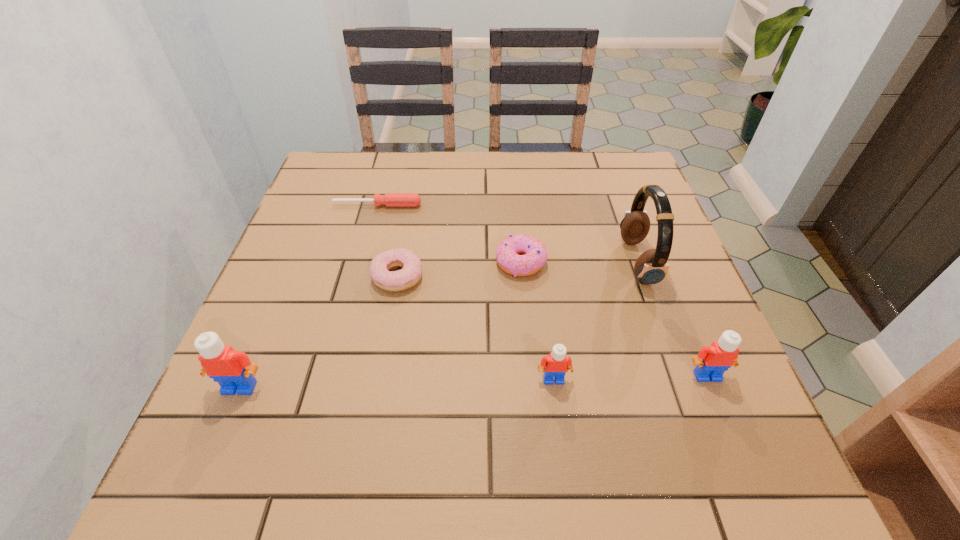
Identify the location of vacant region at the far right corner of the desktop. (635, 192).

The width and height of the screenshot is (960, 540). What are the coordinates of `vacant region at the near right corner of the desktop` in the screenshot? It's located at (720, 384).

Where is `empty space between the leftmost Lego and the shortest Lego`? This screenshot has width=960, height=540. empty space between the leftmost Lego and the shortest Lego is located at coordinates (396, 383).

At what (x,y) coordinates should I click in order to perform the action: click on free spot between the rightmost Lego and the taller doughnut. Please return your answer as a coordinate pair (x, y). Looking at the image, I should click on (613, 319).

Find the location of a particular element. The height and width of the screenshot is (540, 960). vacant area that lies between the shortest Lego and the screwdriver is located at coordinates (466, 292).

Find the location of a particular element. empty space that is in between the right doughnut and the shortest object is located at coordinates (449, 233).

You are a GUI agent. You are given a task and a screenshot of the screen. Output one action in this format:
    pyautogui.click(x=<x>, y=<y>)
    Task: Click on the vacant area that lies between the screwdriver and the right doughnut
    
    Given the screenshot: What is the action you would take?
    pyautogui.click(x=449, y=233)

Locate an element on the screen. empty space between the third tallest object and the tallest Lego is located at coordinates (473, 381).

At what (x,y) coordinates should I click in order to perform the action: click on vacant point located between the shortest Lego and the right doughnut. Please return your answer as a coordinate pair (x, y). Looking at the image, I should click on (537, 321).

At what (x,y) coordinates should I click in order to perform the action: click on vacant point located between the farthest object and the second tallest Lego. Please return your answer as a coordinate pair (x, y). The width and height of the screenshot is (960, 540). Looking at the image, I should click on (542, 291).